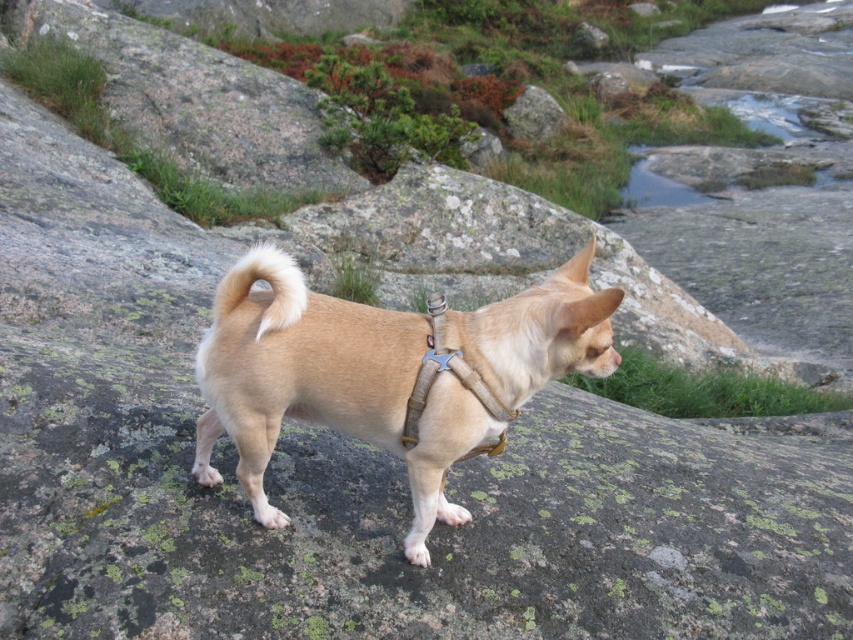
Question: Is tan fabric dog at center below fuzzy beige tail at center?

Choices:
 (A) no
 (B) yes

Answer: (B)

Question: Does tan fabric dog at center have a smaller size compared to fuzzy beige tail at center?

Choices:
 (A) no
 (B) yes

Answer: (A)

Question: Which point is closer to the camera?

Choices:
 (A) (525, 353)
 (B) (215, 296)

Answer: (A)

Question: Where is tan fabric dog at center located in relation to fuzzy beige tail at center in the image?

Choices:
 (A) right
 (B) left

Answer: (A)